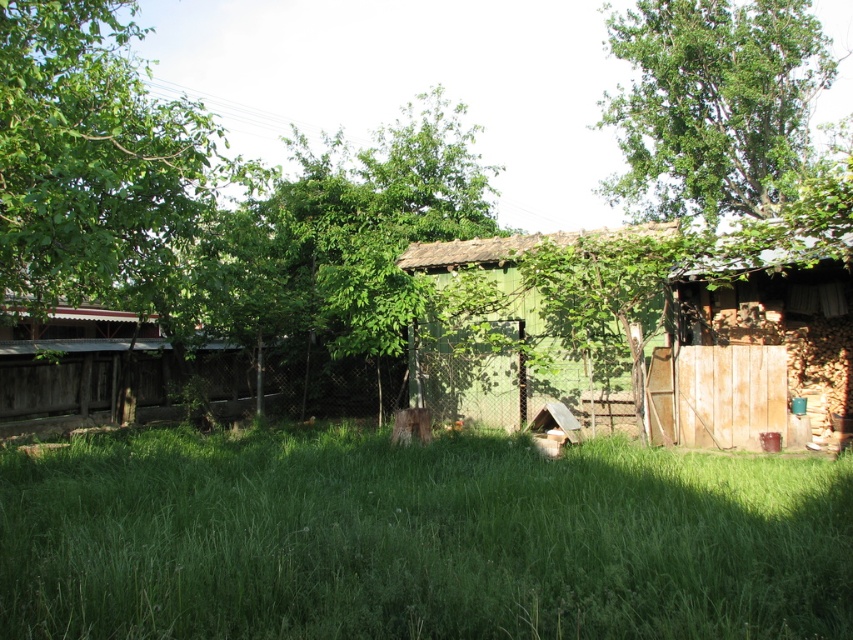
You are planning to plant a new tree in your backyard. You have two options in the image, the green leafy tree at center and the green wooden hut at center. Which one is bigger in size?

The green leafy tree at center is larger in size than the green wooden hut at center, so the green leafy tree at center is bigger.

You are planning to install a sprinkler system between the green leafy tree at upper right and the green wooden hut at center. The sprinkler system requires a minimum of 60 feet of space between the tree and the hut to function properly. Based on the scene description, will the current distance allow the sprinkler system to be installed?

The distance between the green leafy tree at upper right and the green wooden hut at center is 59.13 feet, which is less than the required 60 feet. Therefore, the sprinkler system cannot be installed with the current spacing.

From the picture: You are standing in the middle of the backyard and want to walk towards the green leafy tree at center. Which direction should you head?

Since the green leafy tree at center is located at point (346, 236), you should head towards the center of the backyard where the tree is positioned.